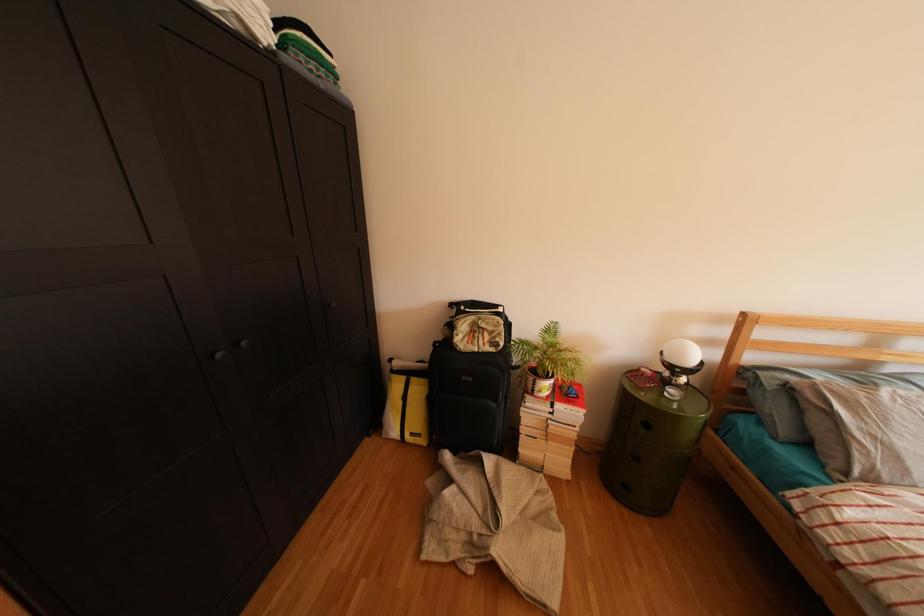
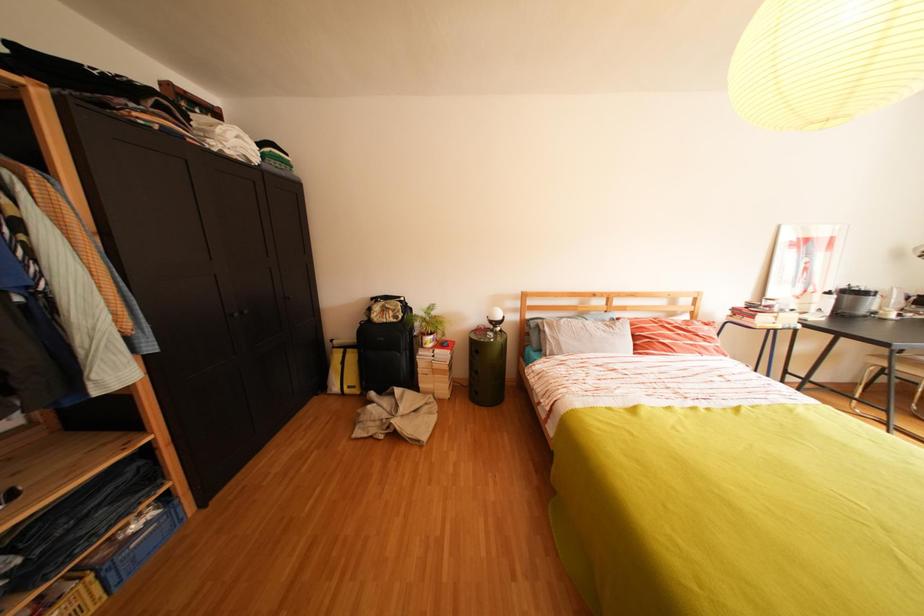
Question: The images are taken continuously from a first-person perspective. In which direction is your viewpoint rotating?

Choices:
 (A) Left
 (B) Right
 (C) Up
 (D) Down

Answer: (B)